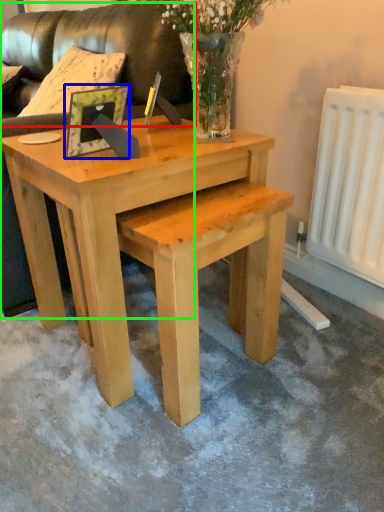
Question: Based on their relative distances, which object is nearer to couch (highlighted by a red box)? Choose from picture frame (highlighted by a blue box) and couch (highlighted by a green box).

Choices:
 (A) picture frame
 (B) couch

Answer: (B)